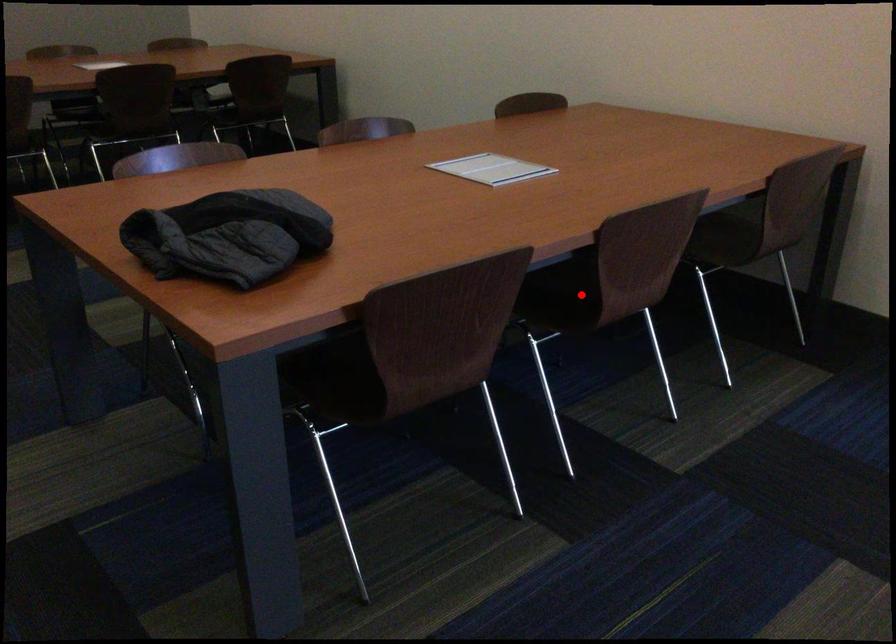
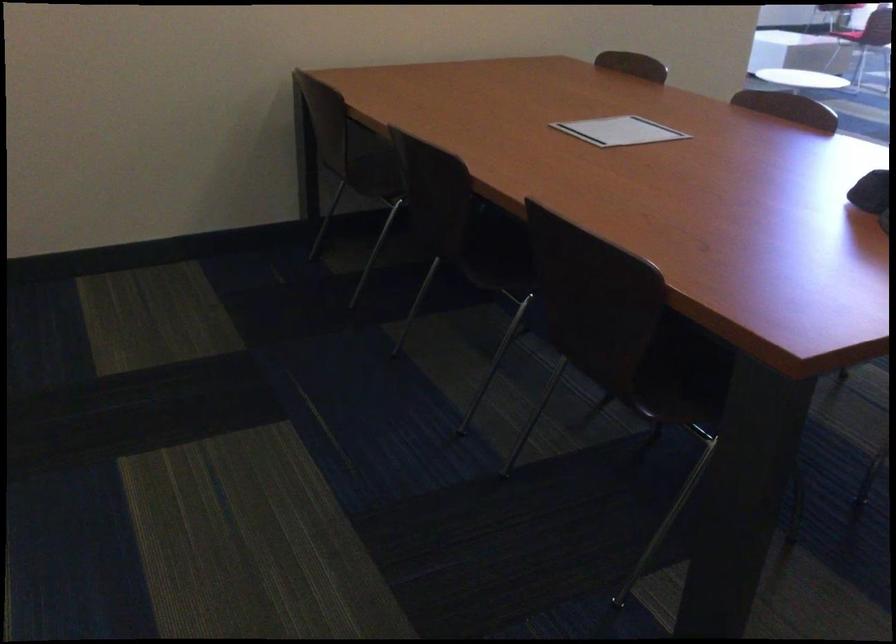
Question: I am providing you with two images of the same scene from different viewpoints. A red point is marked on the first image. At the location where the point appears in image 1, is it still visible in image 2?

Choices:
 (A) Yes
 (B) No

Answer: (B)